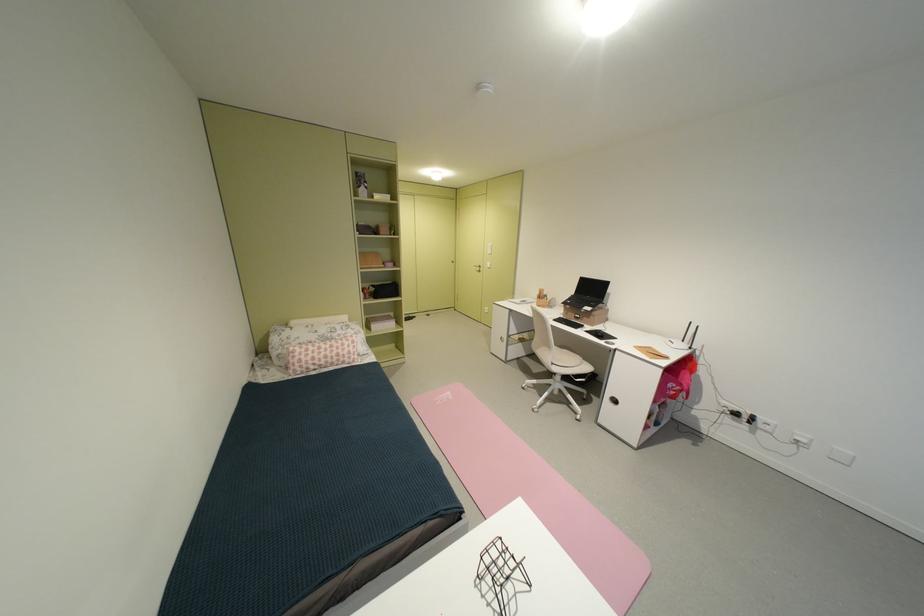
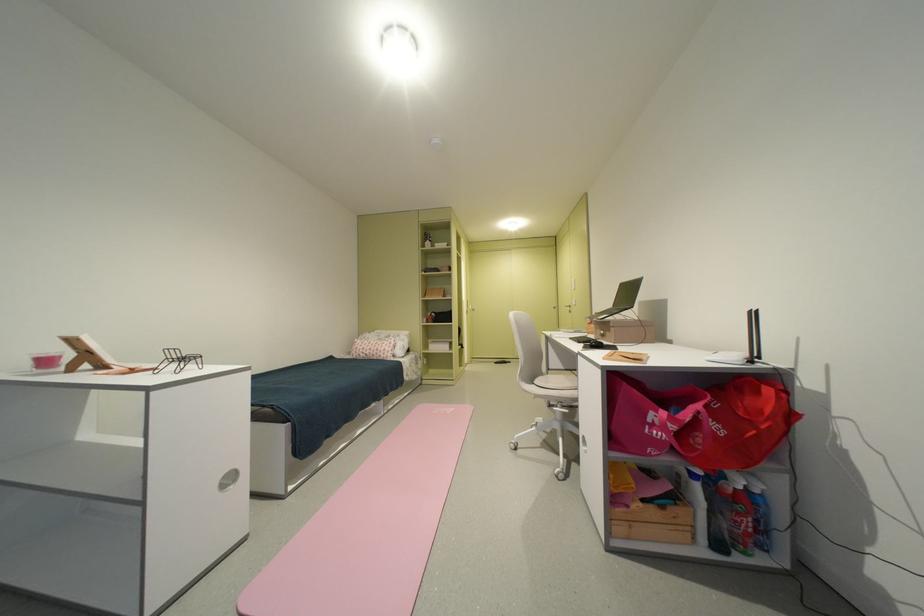
Locate, in the second image, the point that corresponds to point (660, 429) in the first image.

(638, 508)